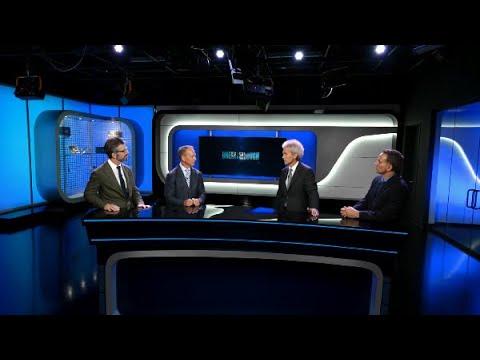
What are the coordinates of `long black desk` in the screenshot? It's located at (248, 232).